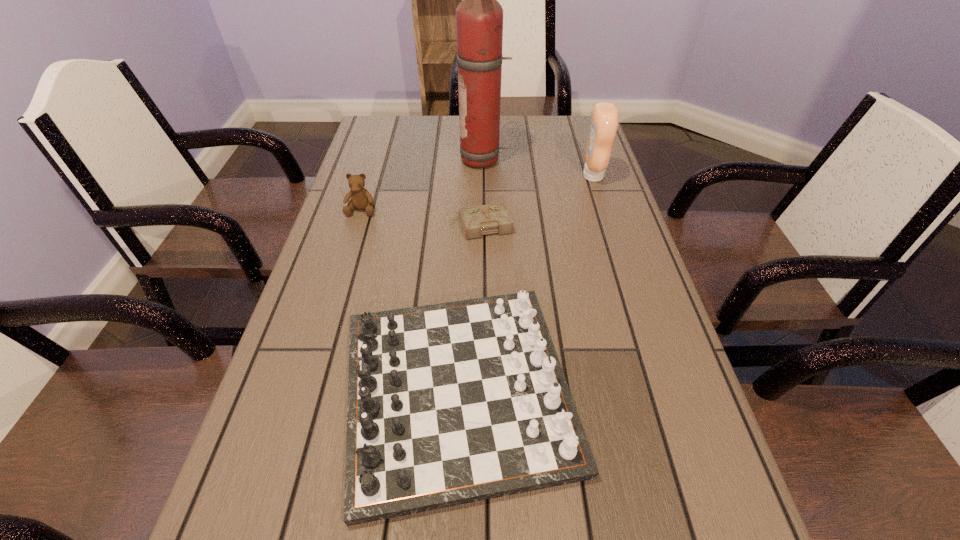
You are a GUI agent. You are given a task and a screenshot of the screen. Output one action in this format:
    pyautogui.click(x=<x>, y=<y>)
    Task: Click on the vacant point located between the fire extinguisher and the nearest object
    The height and width of the screenshot is (540, 960).
    Given the screenshot: What is the action you would take?
    pyautogui.click(x=471, y=275)

Where is `object that is the second closest to the rightmost object`? object that is the second closest to the rightmost object is located at coordinates click(x=493, y=218).

Identify which object is the fourth nearest to the fire extinguisher. Please provide its 2D coordinates. Your answer should be formatted as a tuple, i.e. [(x, y)], where the tuple contains the x and y coordinates of a point satisfying the conditions above.

[(452, 403)]

Where is `free location that satisfies the following two spatial constraints: 1. on the label of the rightmost object; 2. on the front-facing side of the leftmost object`? The width and height of the screenshot is (960, 540). free location that satisfies the following two spatial constraints: 1. on the label of the rightmost object; 2. on the front-facing side of the leftmost object is located at coordinates (603, 210).

Where is `free space that satisfies the following two spatial constraints: 1. on the side of the fire extinguisher with the label and nozzle; 2. on the front side of the shortest object`? free space that satisfies the following two spatial constraints: 1. on the side of the fire extinguisher with the label and nozzle; 2. on the front side of the shortest object is located at coordinates (485, 225).

Locate an element on the screen. free space that satisfies the following two spatial constraints: 1. on the back side of the nearest object; 2. on the left side of the diary is located at coordinates (465, 225).

At what (x,y) coordinates should I click in order to perform the action: click on vacant space that satisfies the following two spatial constraints: 1. on the label of the condiment; 2. on the front-facing side of the leftmost object. Please return your answer as a coordinate pair (x, y). Looking at the image, I should click on (603, 210).

Where is `vacant space that satisfies the following two spatial constraints: 1. on the front-facing side of the diary; 2. on the left side of the leftmost object`? The width and height of the screenshot is (960, 540). vacant space that satisfies the following two spatial constraints: 1. on the front-facing side of the diary; 2. on the left side of the leftmost object is located at coordinates (357, 225).

At what (x,y) coordinates should I click in order to perform the action: click on vacant space that satisfies the following two spatial constraints: 1. on the side of the tallest object with the label and nozzle; 2. on the front-facing side of the teddy bear. Please return your answer as a coordinate pair (x, y). This screenshot has height=540, width=960. Looking at the image, I should click on (485, 210).

Where is `free region that satisfies the following two spatial constraints: 1. on the label of the second tallest object; 2. on the front-facing side of the teddy bear`? The image size is (960, 540). free region that satisfies the following two spatial constraints: 1. on the label of the second tallest object; 2. on the front-facing side of the teddy bear is located at coordinates (603, 210).